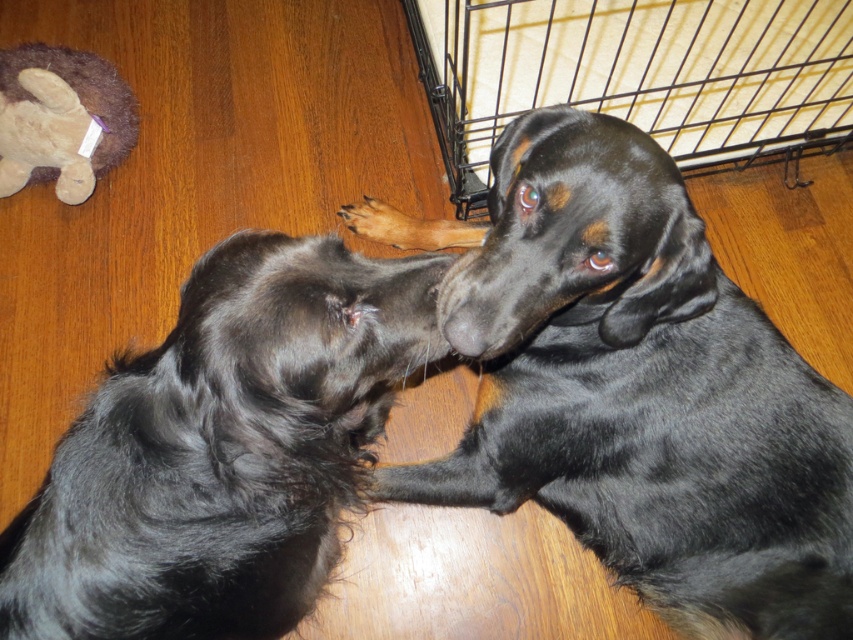
Question: Where is black wire cage at lower right located in relation to fuzzy brown stuffed animal at upper left in the image?

Choices:
 (A) left
 (B) right

Answer: (B)

Question: Is black shiny fur dog at center bigger than shiny black fur at center?

Choices:
 (A) yes
 (B) no

Answer: (A)

Question: Estimate the real-world distances between objects in this image. Which object is farther from the shiny black fur at center?

Choices:
 (A) black shiny fur dog at center
 (B) fuzzy brown stuffed animal at upper left
 (C) black wire cage at lower right

Answer: (B)

Question: Among these objects, which one is nearest to the camera?

Choices:
 (A) fuzzy brown stuffed animal at upper left
 (B) black shiny fur dog at center

Answer: (B)

Question: From the image, what is the correct spatial relationship of black shiny fur dog at center in relation to shiny black fur at center?

Choices:
 (A) above
 (B) below

Answer: (A)

Question: Which object appears farthest from the camera in this image?

Choices:
 (A) black shiny fur dog at center
 (B) fuzzy brown stuffed animal at upper left
 (C) black wire cage at lower right
 (D) shiny black fur at center

Answer: (B)